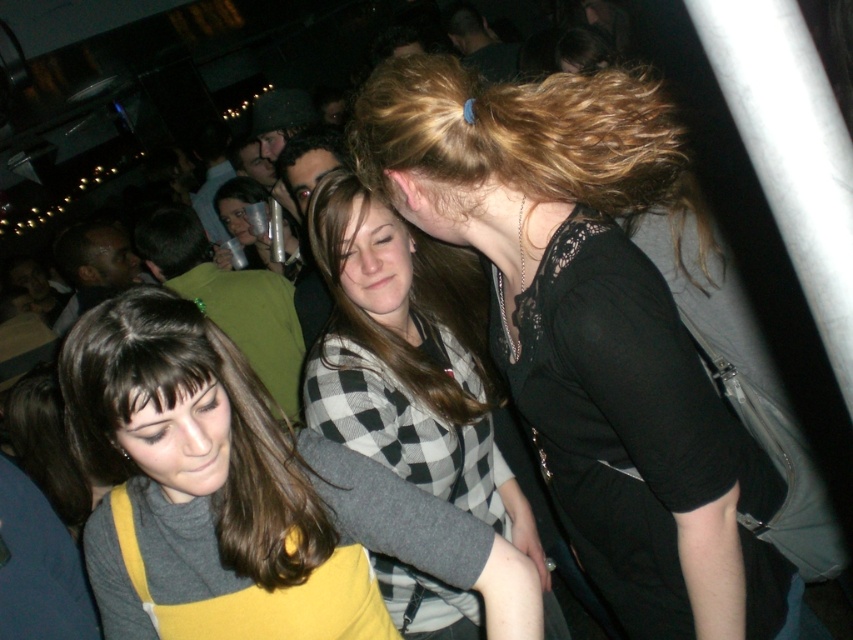
Looking at the three people in the foreground of the nightclub scene, can you determine if the checkered fabric sweater at center is positioned to the left or right of the brownsmoothhair at center?

The checkered fabric sweater at center is to the right of brownsmoothhair at center.

You are at a party and want to take a photo of the matte yellow dress at center and the brownsmoothhair at center. Which one will appear larger in the photo?

The matte yellow dress at center will appear larger in the photo because it is taller than brownsmoothhair at center.

You are at a party and want to take a photo of the matte yellow dress at center and the checkered fabric sweater at center. Which one is on the left side when facing the two people?

The matte yellow dress at center is positioned on the left side of the checkered fabric sweater at center, so when facing the two people, the matte yellow dress at center is on the left side.